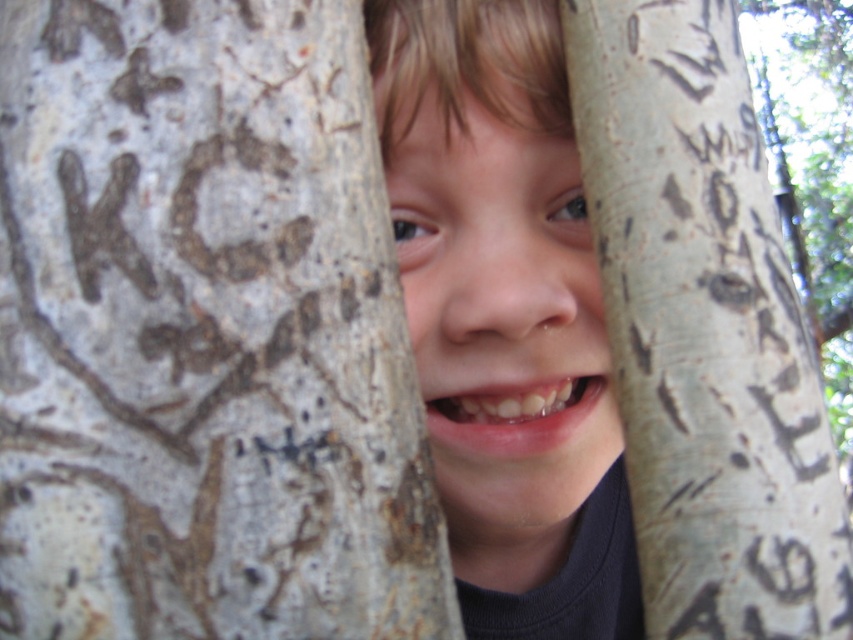
You are a photographer trying to capture the child peeking through the trees. Based on the scene, can you determine if the light gray bark tree at center is taller than the smooth skin face at center?

The light gray bark tree at center is shorter than the smooth skin face at center, so the tree is not taller than the child.